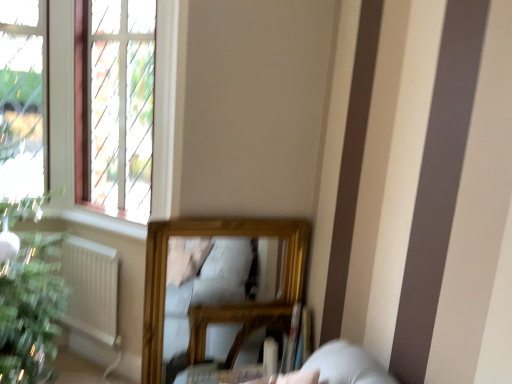
Question: Can you confirm if green matte houseplant at lower left is bigger than clear glass window at upper left?

Choices:
 (A) no
 (B) yes

Answer: (A)

Question: Considering the relative positions of green matte houseplant at lower left and clear glass window at upper left in the image provided, is green matte houseplant at lower left to the right of clear glass window at upper left from the viewer's perspective?

Choices:
 (A) yes
 (B) no

Answer: (B)

Question: Is green matte houseplant at lower left positioned far away from clear glass window at upper left?

Choices:
 (A) no
 (B) yes

Answer: (A)

Question: Does green matte houseplant at lower left have a lesser height compared to clear glass window at upper left?

Choices:
 (A) yes
 (B) no

Answer: (A)

Question: From a real-world perspective, does green matte houseplant at lower left stand above clear glass window at upper left?

Choices:
 (A) yes
 (B) no

Answer: (B)

Question: From the image's perspective, is green matte houseplant at lower left above clear glass window at upper left?

Choices:
 (A) yes
 (B) no

Answer: (B)

Question: Is green matte houseplant at lower left positioned behind white matte radiator at lower left?

Choices:
 (A) no
 (B) yes

Answer: (B)

Question: Does green matte houseplant at lower left have a smaller size compared to white matte radiator at lower left?

Choices:
 (A) yes
 (B) no

Answer: (A)

Question: Is green matte houseplant at lower left oriented away from white matte radiator at lower left?

Choices:
 (A) yes
 (B) no

Answer: (B)

Question: Considering the relative positions of green matte houseplant at lower left and white matte radiator at lower left in the image provided, is green matte houseplant at lower left in front of white matte radiator at lower left?

Choices:
 (A) no
 (B) yes

Answer: (A)

Question: Can you confirm if green matte houseplant at lower left is bigger than white matte radiator at lower left?

Choices:
 (A) yes
 (B) no

Answer: (B)

Question: Is green matte houseplant at lower left with white matte radiator at lower left?

Choices:
 (A) yes
 (B) no

Answer: (B)

Question: From the image's perspective, is clear glass window at upper left below green matte houseplant at lower left?

Choices:
 (A) no
 (B) yes

Answer: (A)